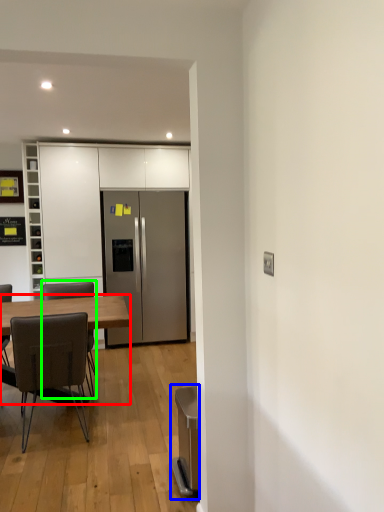
Question: Which is farther away from desk (highlighted by a red box)? appliance (highlighted by a blue box) or chair (highlighted by a green box)?

Choices:
 (A) appliance
 (B) chair

Answer: (B)